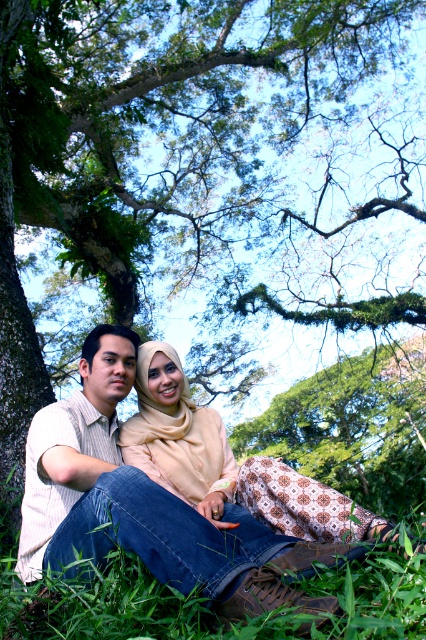
Is denim jeans at lower center shorter than striped knit sweater at center?

Yes, denim jeans at lower center is shorter than striped knit sweater at center.

Between denim jeans at lower center and striped knit sweater at center, which one appears on the right side from the viewer's perspective?

denim jeans at lower center is more to the right.

Between point (68, 406) and point (123, 365), which one is positioned in front?

Point (68, 406) is more forward.

Identify the location of denim jeans at lower center. (129, 497).

Describe the element at coordinates (115, 609) in the screenshot. I see `green grass at lower center` at that location.

Where is `green grass at lower center`? This screenshot has width=426, height=640. green grass at lower center is located at coordinates (115, 609).

Which is in front, point (112, 566) or point (100, 451)?

Point (112, 566)

Where is `green grass at lower center`? The width and height of the screenshot is (426, 640). green grass at lower center is located at coordinates (115, 609).

Can you confirm if striped knit sweater at center is positioned above beige fabric hijab at center?

Yes, striped knit sweater at center is above beige fabric hijab at center.

Looking at this image, which is below, striped knit sweater at center or beige fabric hijab at center?

beige fabric hijab at center

Who is more forward, (x=48, y=416) or (x=201, y=484)?

Positioned in front is point (x=48, y=416).

Where is `striped knit sweater at center`? This screenshot has width=426, height=640. striped knit sweater at center is located at coordinates (74, 442).